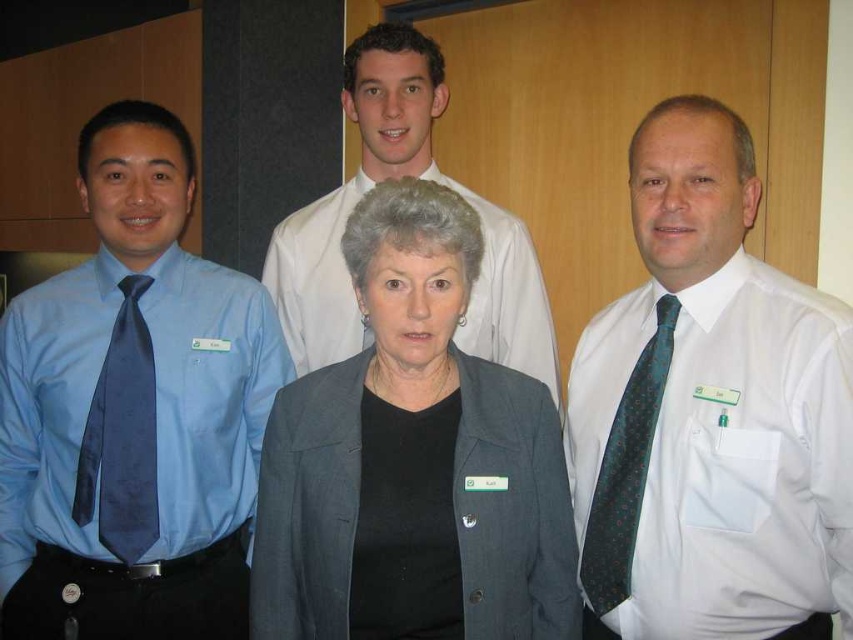
Question: Can you confirm if matte blue shirt at left is positioned to the left of white shirt at upper center?

Choices:
 (A) no
 (B) yes

Answer: (B)

Question: Which is farther from the gray woolen blazer at center?

Choices:
 (A) green dotted silk tie at right
 (B) matte blue tie at left
 (C) white shirt at upper center

Answer: (C)

Question: Is white shirt at right thinner than gray woolen blazer at center?

Choices:
 (A) yes
 (B) no

Answer: (A)

Question: Is white shirt at right in front of gray woolen blazer at center?

Choices:
 (A) yes
 (B) no

Answer: (B)

Question: Estimate the real-world distances between objects in this image. Which object is farther from the white shirt at right?

Choices:
 (A) green dotted silk tie at right
 (B) matte blue tie at left
 (C) matte blue shirt at left

Answer: (B)

Question: Which point is closer to the camera taking this photo?

Choices:
 (A) pyautogui.click(x=657, y=326)
 (B) pyautogui.click(x=279, y=282)
 (C) pyautogui.click(x=90, y=484)

Answer: (A)